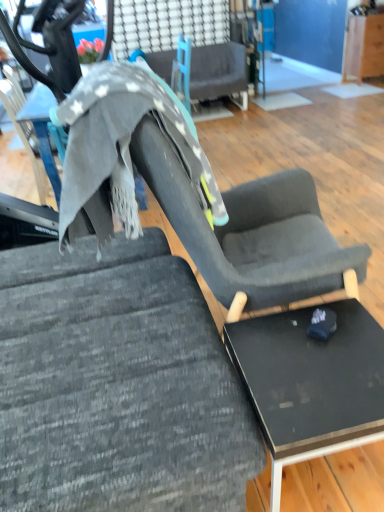
Question: Are black glossy table at lower right and textured gray fabric at center, the second chair in the top-to-bottom sequence, located far from each other?

Choices:
 (A) yes
 (B) no

Answer: (B)

Question: Is black glossy table at lower right looking in the opposite direction of textured gray fabric at center, placed as the 1th chair when sorted from bottom to top?

Choices:
 (A) no
 (B) yes

Answer: (A)

Question: Is black glossy table at lower right thinner than textured gray fabric at center, the second chair in the top-to-bottom sequence?

Choices:
 (A) yes
 (B) no

Answer: (A)

Question: Is black glossy table at lower right at the right side of textured gray fabric at center, the second chair in the top-to-bottom sequence?

Choices:
 (A) no
 (B) yes

Answer: (B)

Question: Is black glossy table at lower right completely or partially outside of textured gray fabric at center, the second chair in the top-to-bottom sequence?

Choices:
 (A) no
 (B) yes

Answer: (B)

Question: Is the depth of black glossy table at lower right greater than that of textured gray fabric at center, the second chair in the top-to-bottom sequence?

Choices:
 (A) yes
 (B) no

Answer: (A)

Question: Is textured gray fabric chair at center, the 2th chair positioned from the front, in front of textured gray fabric at center, placed as the 1th chair when sorted from bottom to top?

Choices:
 (A) yes
 (B) no

Answer: (B)

Question: From a real-world perspective, is textured gray fabric chair at center, which appears as the 2th chair when ordered from the bottom, positioned over textured gray fabric at center, which is the 2th chair in back-to-front order, based on gravity?

Choices:
 (A) yes
 (B) no

Answer: (B)

Question: Does textured gray fabric chair at center, which appears as the 2th chair when ordered from the bottom, have a larger size compared to textured gray fabric at center, the first chair viewed from the front?

Choices:
 (A) yes
 (B) no

Answer: (B)

Question: Considering the relative sizes of textured gray fabric chair at center, marked as the first chair in a top-to-bottom arrangement, and textured gray fabric at center, placed as the 1th chair when sorted from bottom to top, in the image provided, is textured gray fabric chair at center, marked as the first chair in a top-to-bottom arrangement, thinner than textured gray fabric at center, placed as the 1th chair when sorted from bottom to top,?

Choices:
 (A) yes
 (B) no

Answer: (A)

Question: Is textured gray fabric chair at center, which appears as the 2th chair when ordered from the bottom, directly adjacent to textured gray fabric at center, which is the 2th chair in back-to-front order?

Choices:
 (A) yes
 (B) no

Answer: (B)

Question: Is textured gray fabric at center, the first chair viewed from the front, a part of textured gray fabric chair at center, which appears as the 2th chair when ordered from the bottom?

Choices:
 (A) yes
 (B) no

Answer: (B)

Question: Is textured gray fabric chair at center, the 2th chair positioned from the front, facing towards black glossy table at lower right?

Choices:
 (A) no
 (B) yes

Answer: (B)